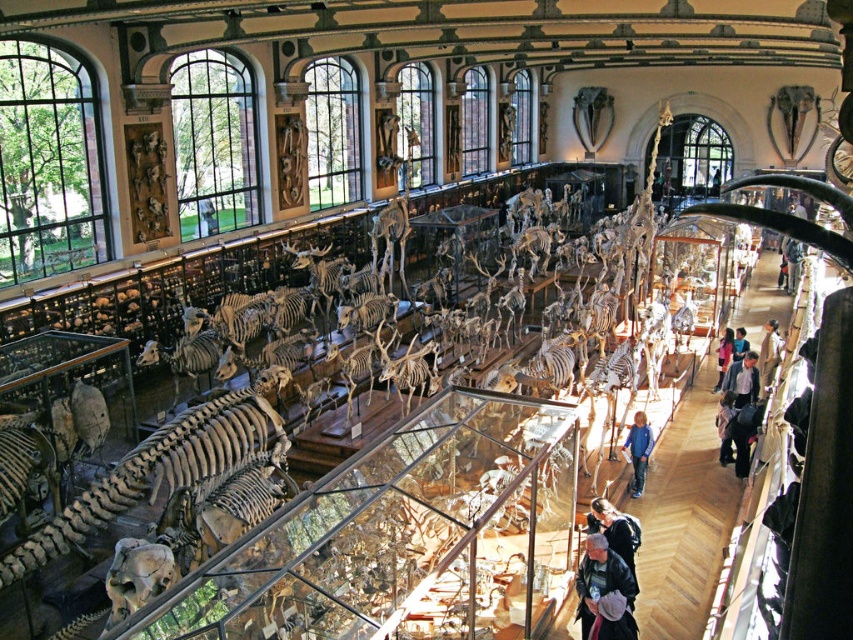
Is blue denim jeans at center wider than light brown leather jacket at right?

No, blue denim jeans at center is not wider than light brown leather jacket at right.

Is blue denim jeans at center thinner than light brown leather jacket at right?

Indeed, blue denim jeans at center has a lesser width compared to light brown leather jacket at right.

Find the location of a particular element. blue denim jeans at center is located at coordinates (637, 451).

Between point (630, 438) and point (740, 390), which one is positioned behind?

Point (740, 390)

Can you confirm if blue denim jeans at center is smaller than light brown leather jacket at center?

Indeed, blue denim jeans at center has a smaller size compared to light brown leather jacket at center.

I want to click on blue denim jeans at center, so click(x=637, y=451).

You are a GUI agent. You are given a task and a screenshot of the screen. Output one action in this format:
    pyautogui.click(x=<x>, y=<y>)
    Task: Click on the blue denim jeans at center
    The image size is (853, 640).
    Given the screenshot: What is the action you would take?
    pyautogui.click(x=637, y=451)

Does dark gray jacket at lower center come behind light blue denim jacket at center?

That is False.

Locate an element on the screen. The image size is (853, 640). dark gray jacket at lower center is located at coordinates (601, 579).

Find the location of a particular element. dark gray jacket at lower center is located at coordinates click(x=601, y=579).